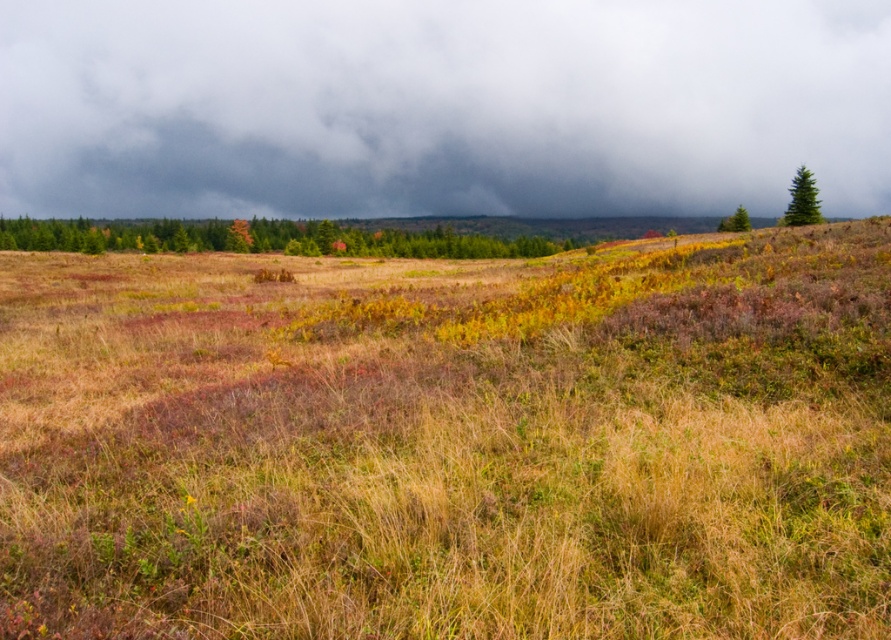
Who is positioned more to the right, green matte tree at upper right or green textured pine at upper right?

green textured pine at upper right is more to the right.

Is point (797, 177) less distant than point (740, 225)?

That is True.

Is point (790, 186) behind point (742, 225)?

No, (790, 186) is closer to viewer.

Locate an element on the screen. This screenshot has height=640, width=891. green matte tree at upper right is located at coordinates (802, 198).

Who is positioned more to the left, dry grass at center or green matte tree at upper right?

From the viewer's perspective, dry grass at center appears more on the left side.

Is point (358, 292) in front of point (813, 182)?

Yes.

Which is behind, point (105, 580) or point (799, 193)?

Point (799, 193)

Where is `dry grass at center`? This screenshot has height=640, width=891. dry grass at center is located at coordinates (450, 442).

Can you confirm if green matte tree at center is taller than green matte tree at upper right?

Result: Yes, green matte tree at center is taller than green matte tree at upper right.

Who is positioned more to the left, green matte tree at center or green matte tree at upper right?

green matte tree at center

Which is behind, point (516, 240) or point (812, 198)?

Point (516, 240)

Where is `green matte tree at center`? Image resolution: width=891 pixels, height=640 pixels. green matte tree at center is located at coordinates (268, 237).